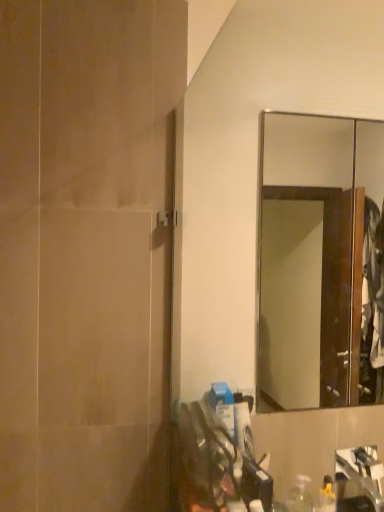
You are a GUI agent. You are given a task and a screenshot of the screen. Output one action in this format:
    pyautogui.click(x=<x>, y=<y>)
    Task: Click on the wooden-framed mirror at upper right
    The height and width of the screenshot is (512, 384).
    Given the screenshot: What is the action you would take?
    pyautogui.click(x=320, y=263)

Describe the element at coordinates (320, 263) in the screenshot. I see `wooden-framed mirror at upper right` at that location.

Measure the distance between point (x=345, y=249) and camera.

Point (x=345, y=249) and camera are 2.73 meters apart from each other.

You are a GUI agent. You are given a task and a screenshot of the screen. Output one action in this format:
    pyautogui.click(x=<x>, y=<y>)
    Task: Click on the matte beige screen door at left
    
    Given the screenshot: What is the action you would take?
    pyautogui.click(x=106, y=326)

Image resolution: width=384 pixels, height=512 pixels. Describe the element at coordinates (106, 326) in the screenshot. I see `matte beige screen door at left` at that location.

At what (x,y) coordinates should I click in order to perform the action: click on wooden-framed mirror at upper right. Please return your answer as a coordinate pair (x, y). Looking at the image, I should click on (320, 263).

Does wooden-framed mirror at upper right appear on the right side of matte beige screen door at left?

Yes, wooden-framed mirror at upper right is to the right of matte beige screen door at left.

Which object is closer to the camera, wooden-framed mirror at upper right or matte beige screen door at left?

matte beige screen door at left is more forward.

Is point (301, 162) closer or farther from the camera than point (153, 154)?

Point (301, 162) is positioned farther from the camera compared to point (153, 154).

From the image's perspective, between wooden-framed mirror at upper right and matte beige screen door at left, which one is located above?

matte beige screen door at left is shown above in the image.

From a real-world perspective, between wooden-framed mirror at upper right and matte beige screen door at left, who is vertically higher?

In real-world perspective, matte beige screen door at left is above.

Is wooden-framed mirror at upper right wider than matte beige screen door at left?

Yes, wooden-framed mirror at upper right is wider than matte beige screen door at left.

Can you confirm if wooden-framed mirror at upper right is taller than matte beige screen door at left?

Incorrect, the height of wooden-framed mirror at upper right is not larger of that of matte beige screen door at left.

Considering the sizes of objects wooden-framed mirror at upper right and matte beige screen door at left in the image provided, who is smaller, wooden-framed mirror at upper right or matte beige screen door at left?

wooden-framed mirror at upper right.

Is wooden-framed mirror at upper right outside of matte beige screen door at left?

wooden-framed mirror at upper right is positioned outside matte beige screen door at left.

From the picture: Are wooden-framed mirror at upper right and matte beige screen door at left located far from each other?

No.

Is wooden-framed mirror at upper right aimed at matte beige screen door at left?

No.

How much distance is there between wooden-framed mirror at upper right and matte beige screen door at left?

wooden-framed mirror at upper right is 35.44 inches from matte beige screen door at left.

Identify the location of screen door above the wooden-framed mirror at upper right (from a real-world perspective). (106, 326).

In the image, is matte beige screen door at left on the left side or the right side of wooden-framed mirror at upper right?

Clearly, matte beige screen door at left is on the left of wooden-framed mirror at upper right in the image.

Is matte beige screen door at left in front of wooden-framed mirror at upper right?

Yes, it is.

Is point (90, 395) behind point (345, 236)?

That is False.

From the image's perspective, is matte beige screen door at left on top of wooden-framed mirror at upper right?

Yes, from the image's perspective, matte beige screen door at left is over wooden-framed mirror at upper right.

From a real-world perspective, is matte beige screen door at left beneath wooden-framed mirror at upper right?

Incorrect, from a real-world perspective, matte beige screen door at left is higher than wooden-framed mirror at upper right.

Considering the sizes of objects matte beige screen door at left and wooden-framed mirror at upper right in the image provided, who is thinner, matte beige screen door at left or wooden-framed mirror at upper right?

matte beige screen door at left.

Is matte beige screen door at left taller than wooden-framed mirror at upper right?

Indeed, matte beige screen door at left has a greater height compared to wooden-framed mirror at upper right.

Which of these two, matte beige screen door at left or wooden-framed mirror at upper right, is bigger?

matte beige screen door at left.

Is matte beige screen door at left not within wooden-framed mirror at upper right?

matte beige screen door at left is positioned outside wooden-framed mirror at upper right.

Would you say matte beige screen door at left is a long distance from wooden-framed mirror at upper right?

No, matte beige screen door at left is not far away from wooden-framed mirror at upper right.

Is matte beige screen door at left facing towards wooden-framed mirror at upper right?

No, matte beige screen door at left is not facing towards wooden-framed mirror at upper right.

How many degrees apart are the facing directions of matte beige screen door at left and wooden-framed mirror at upper right?

The facing directions of matte beige screen door at left and wooden-framed mirror at upper right are 0.433 degrees apart.

Where is `mirror lying behind the matte beige screen door at left`? The height and width of the screenshot is (512, 384). mirror lying behind the matte beige screen door at left is located at coordinates (320, 263).

At what (x,y) coordinates should I click in order to perform the action: click on mirror located underneath the matte beige screen door at left (from a real-world perspective). Please return your answer as a coordinate pair (x, y). Looking at the image, I should click on (320, 263).

Identify the location of mirror behind the matte beige screen door at left. (320, 263).